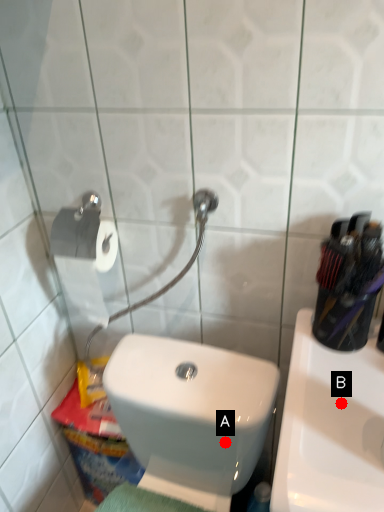
Question: Two points are circled on the image, labeled by A and B beside each circle. Which of the following is the farthest from the observer?

Choices:
 (A) A is further
 (B) B is further

Answer: (A)